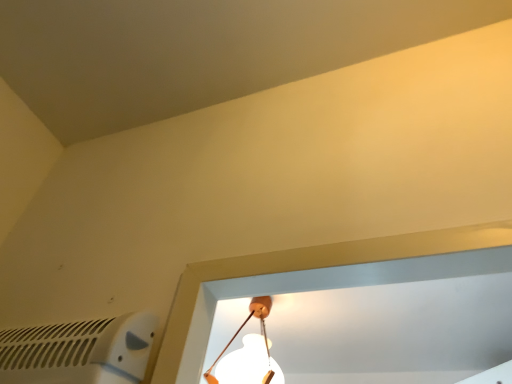
Question: Is white plastic air conditioning at lower left taller than white matte lamp at center?

Choices:
 (A) no
 (B) yes

Answer: (A)

Question: Is white plastic air conditioning at lower left smaller than white matte lamp at center?

Choices:
 (A) yes
 (B) no

Answer: (A)

Question: Can you see white plastic air conditioning at lower left touching white matte lamp at center?

Choices:
 (A) no
 (B) yes

Answer: (A)

Question: From the image's perspective, does white plastic air conditioning at lower left appear higher than white matte lamp at center?

Choices:
 (A) yes
 (B) no

Answer: (A)

Question: Considering the relative positions of white plastic air conditioning at lower left and white matte lamp at center in the image provided, is white plastic air conditioning at lower left to the left of white matte lamp at center from the viewer's perspective?

Choices:
 (A) yes
 (B) no

Answer: (A)

Question: Is white plastic air conditioning at lower left oriented towards white matte lamp at center?

Choices:
 (A) yes
 (B) no

Answer: (B)

Question: Does white matte lamp at center have a greater height compared to white plastic air conditioning at lower left?

Choices:
 (A) no
 (B) yes

Answer: (B)

Question: From the image's perspective, does white matte lamp at center appear lower than white plastic air conditioning at lower left?

Choices:
 (A) yes
 (B) no

Answer: (A)

Question: Can you confirm if white matte lamp at center is positioned to the left of white plastic air conditioning at lower left?

Choices:
 (A) yes
 (B) no

Answer: (B)

Question: Is white matte lamp at center thinner than white plastic air conditioning at lower left?

Choices:
 (A) yes
 (B) no

Answer: (B)

Question: Is white matte lamp at center looking in the opposite direction of white plastic air conditioning at lower left?

Choices:
 (A) yes
 (B) no

Answer: (B)

Question: From a real-world perspective, does white matte lamp at center stand above white plastic air conditioning at lower left?

Choices:
 (A) no
 (B) yes

Answer: (B)

Question: Is point (137, 332) closer or farther from the camera than point (223, 372)?

Choices:
 (A) closer
 (B) farther

Answer: (A)